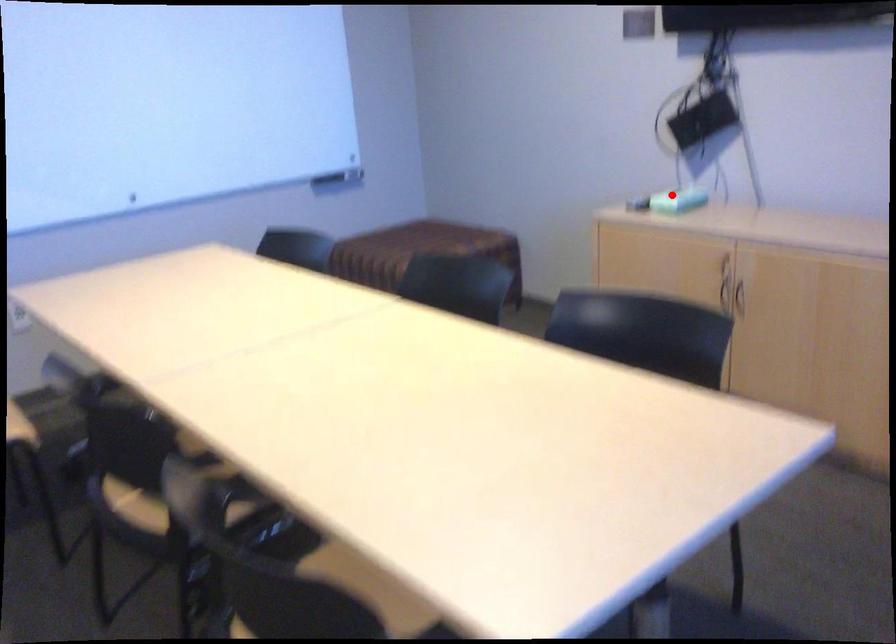
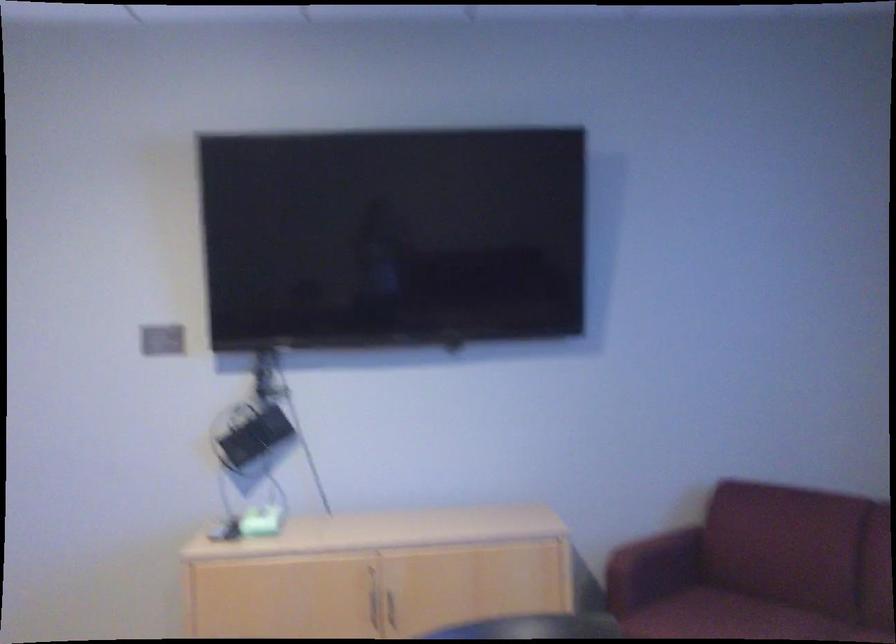
Where in the second image is the point corresponding to the highlighted location from the first image?

(257, 522)